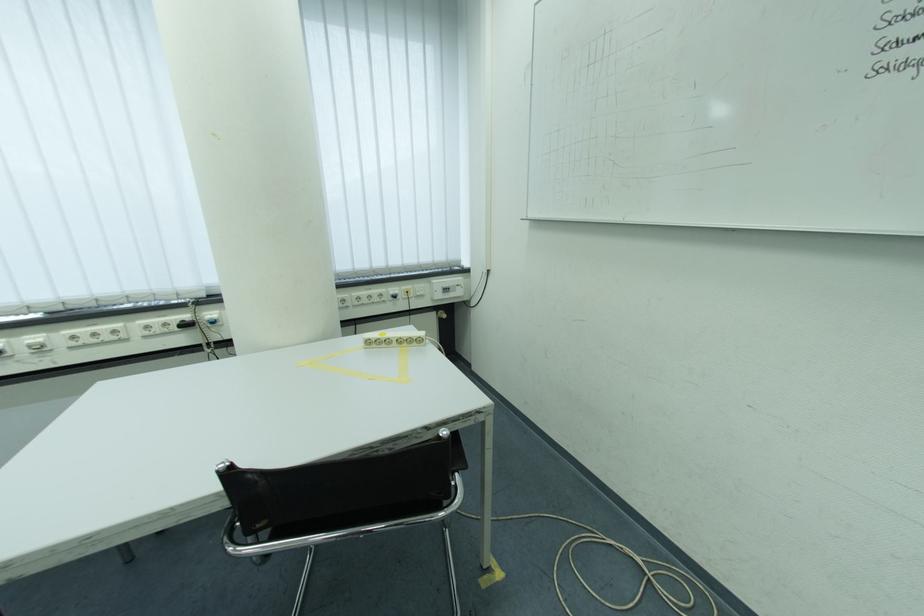
The width and height of the screenshot is (924, 616). Describe the element at coordinates (446, 288) in the screenshot. I see `the white power switch` at that location.